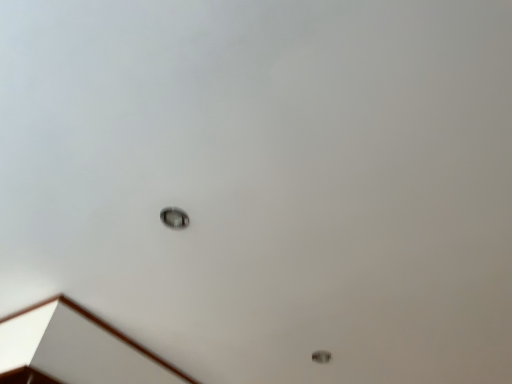
Question: Is point (316, 352) positioned closer to the camera than point (174, 221)?

Choices:
 (A) closer
 (B) farther

Answer: (B)

Question: In the image, is metallic ring at lower right positioned in front of or behind metallic circular light fixture at center?

Choices:
 (A) behind
 (B) front

Answer: (A)

Question: Considering the positions of metallic ring at lower right and metallic circular light fixture at center in the image, is metallic ring at lower right taller or shorter than metallic circular light fixture at center?

Choices:
 (A) tall
 (B) short

Answer: (B)

Question: From their relative heights in the image, would you say metallic circular light fixture at center is taller or shorter than metallic ring at lower right?

Choices:
 (A) short
 (B) tall

Answer: (B)

Question: In the image, is metallic circular light fixture at center positioned in front of or behind metallic ring at lower right?

Choices:
 (A) behind
 (B) front

Answer: (B)

Question: Would you say metallic circular light fixture at center is inside or outside metallic ring at lower right?

Choices:
 (A) inside
 (B) outside

Answer: (B)

Question: Is point (169, 218) positioned closer to the camera than point (329, 359)?

Choices:
 (A) closer
 (B) farther

Answer: (A)